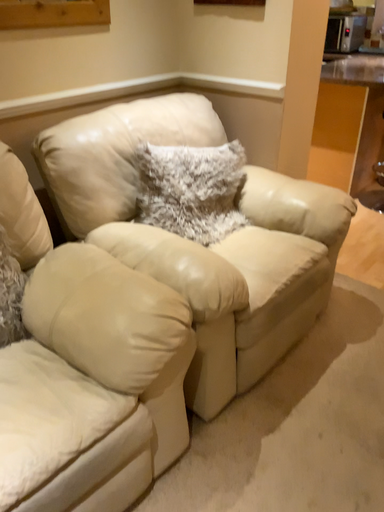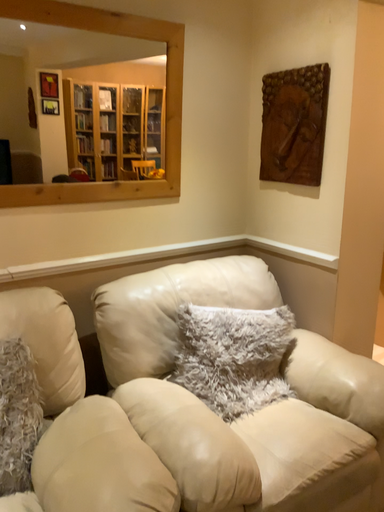
Question: Which way did the camera rotate in the video?

Choices:
 (A) rotated left
 (B) rotated right

Answer: (A)